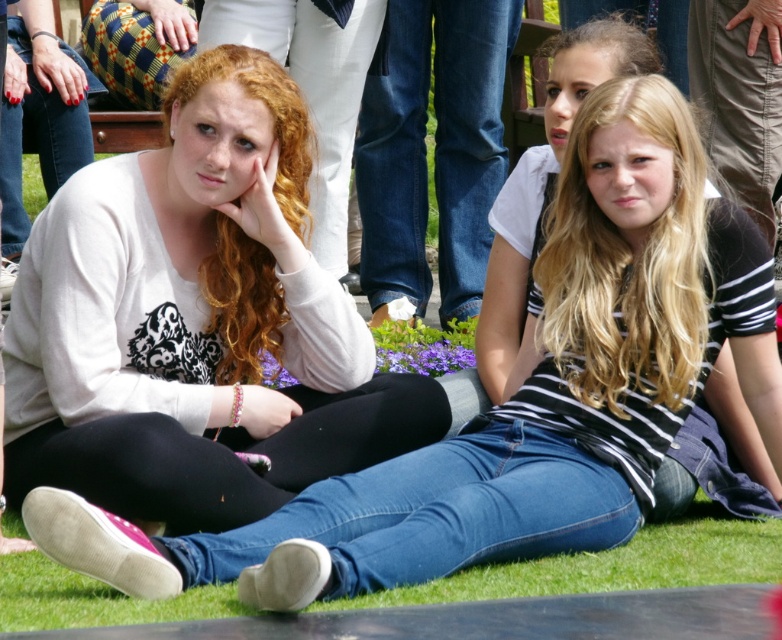
Between white matte shirt at center and striped cotton shirt at center, which one has more height?

With more height is white matte shirt at center.

Which is above, white matte shirt at center or striped cotton shirt at center?

striped cotton shirt at center

Who is more distant from viewer, (16,305) or (680,474)?

Positioned behind is point (680,474).

Image resolution: width=782 pixels, height=640 pixels. Find the location of `white matte shirt at center`. white matte shirt at center is located at coordinates (196, 321).

Between white matte shirt at center and green grass at lower center, which one is positioned higher?

white matte shirt at center is above.

Who is more distant from viewer, (185, 531) or (221, 604)?

Positioned behind is point (185, 531).

Describe the element at coordinates (196, 321) in the screenshot. I see `white matte shirt at center` at that location.

Where is `white matte shirt at center`? The height and width of the screenshot is (640, 782). white matte shirt at center is located at coordinates (x=196, y=321).

Measure the distance between striped cotton shirt at center and camera.

striped cotton shirt at center and camera are 14.05 meters apart from each other.

Which of these two, striped cotton shirt at center or green grass at lower center, stands shorter?

Standing shorter between the two is green grass at lower center.

Is point (490, 310) in front of point (108, 614)?

No, it is not.

Find the location of a particular element. striped cotton shirt at center is located at coordinates (544, 180).